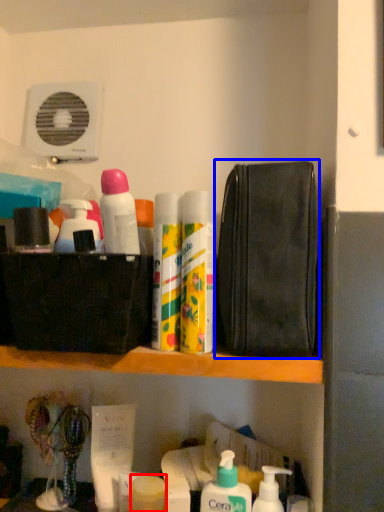
Question: Which point is closer to the camera, toiletry (highlighted by a red box) or pouch (highlighted by a blue box)?

Choices:
 (A) toiletry
 (B) pouch

Answer: (B)